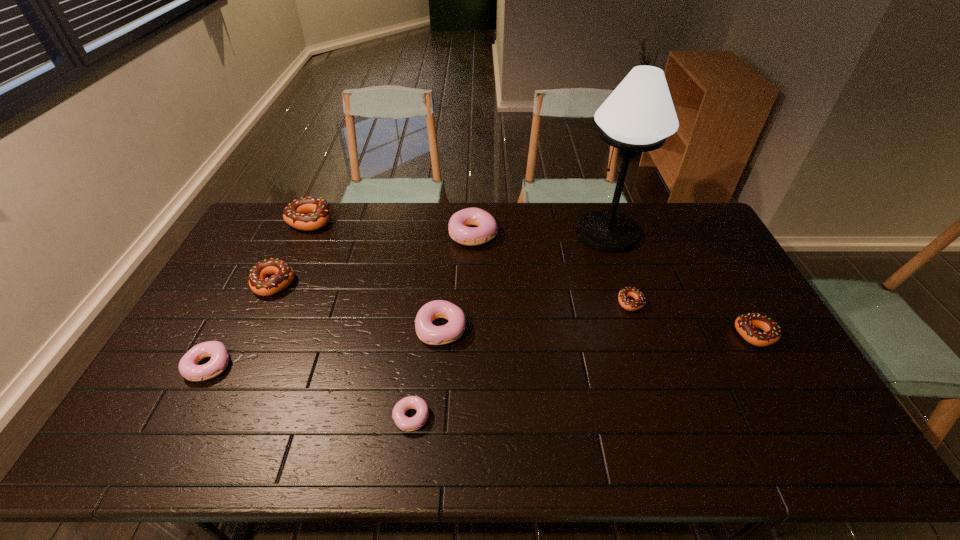
You are a GUI agent. You are given a task and a screenshot of the screen. Output one action in this format:
    pyautogui.click(x=<x>, y=<y>)
    Task: Click on the vacant space that's between the second biggest brown doughnut and the nearest doughnut
    Image resolution: width=960 pixels, height=540 pixels.
    Given the screenshot: What is the action you would take?
    pyautogui.click(x=343, y=350)

Locate which object is the second closest to the second doughnut from right to left. Please provide its 2D coordinates. Your answer should be formatted as a tuple, i.e. [(x, y)], where the tuple contains the x and y coordinates of a point satisfying the conditions above.

[(745, 324)]

At what (x,y) coordinates should I click in order to perform the action: click on the eighth closest object to the farthest purple doughnut. Please return your answer as a coordinate pair (x, y). The width and height of the screenshot is (960, 540). Looking at the image, I should click on (745, 324).

Where is `doughnut that stands as the seventh closest to the nearest object`? This screenshot has width=960, height=540. doughnut that stands as the seventh closest to the nearest object is located at coordinates (745, 324).

Find the location of a particular element. Image resolution: width=960 pixels, height=540 pixels. the seventh closest doughnut relative to the leftmost purple doughnut is located at coordinates coord(745,324).

Locate an element on the screen. Image resolution: width=960 pixels, height=540 pixels. brown doughnut that is the second nearest to the biggest brown doughnut is located at coordinates (631, 305).

Find the location of a particular element. the second closest brown doughnut to the third smallest brown doughnut is located at coordinates (631, 305).

The image size is (960, 540). In order to click on purple doughnut that can be found as the third closest to the second doughnut from right to left in this screenshot , I will do `click(405, 423)`.

Identify which purple doughnut is the third closest to the third smallest purple doughnut. Please provide its 2D coordinates. Your answer should be formatted as a tuple, i.e. [(x, y)], where the tuple contains the x and y coordinates of a point satisfying the conditions above.

[(188, 368)]

Identify the location of free space that satisfies the following two spatial constraints: 1. on the back side of the farthest purple doughnut; 2. on the right side of the second smallest purple doughnut. Image resolution: width=960 pixels, height=540 pixels. (278, 234).